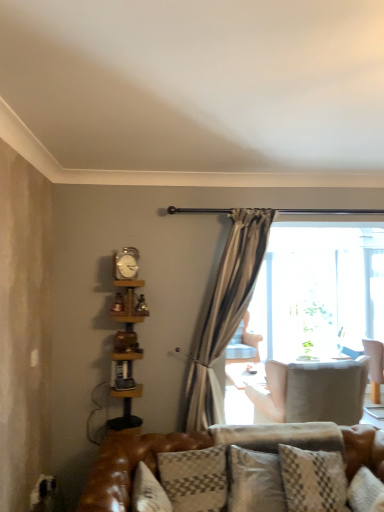
Image resolution: width=384 pixels, height=512 pixels. What are the coordinates of `wooden bookshelf at left` in the screenshot? It's located at (127, 336).

This screenshot has width=384, height=512. Identify the location of velvet beige chair at center, the 1th chair viewed from the back. (243, 344).

Measure the distance between point (314, 402) and camera.

The distance of point (314, 402) from camera is 3.33 meters.

What do you see at coordinates (126, 263) in the screenshot? This screenshot has height=512, width=384. I see `metallic silver clock at upper center` at bounding box center [126, 263].

In the scene shown: In order to face clear glass screen door at center, should I rotate leftwards or rightwards?

Rotate right and turn 10.289 degrees.

Locate an element on the screen. This screenshot has height=512, width=384. plush gray pillow at center, the first pillow when ordered from right to left is located at coordinates (280, 436).

Describe the element at coordinates (195, 479) in the screenshot. This screenshot has width=384, height=512. I see `plaid fabric pillow at center, the 2th pillow in the back-to-front sequence` at that location.

The width and height of the screenshot is (384, 512). I want to click on light beige fabric chair at right, the third chair positioned from the left, so click(375, 367).

From the image's perspective, which one is positioned lower, plaid fabric pillow at center, which is the 1th pillow in left-to-right order, or light beige fabric chair at right, positioned as the first chair in right-to-left order?

light beige fabric chair at right, positioned as the first chair in right-to-left order.

Considering the sizes of plaid fabric pillow at center, which is the 1th pillow in left-to-right order, and light beige fabric chair at right, the third chair positioned from the left, in the image, is plaid fabric pillow at center, which is the 1th pillow in left-to-right order, bigger or smaller than light beige fabric chair at right, the third chair positioned from the left,?

In the image, plaid fabric pillow at center, which is the 1th pillow in left-to-right order, appears to be smaller than light beige fabric chair at right, the third chair positioned from the left.

How many degrees apart are the facing directions of plaid fabric pillow at center, the 2th pillow in the back-to-front sequence, and light beige fabric chair at right, positioned as the first chair in right-to-left order?

93.4 degrees.

Is plaid fabric pillow at center, which is the 1th pillow in left-to-right order, not inside light beige fabric chair at right, arranged as the 2th chair when viewed from the back?

Yes, plaid fabric pillow at center, which is the 1th pillow in left-to-right order, is outside of light beige fabric chair at right, arranged as the 2th chair when viewed from the back.

Is plaid fabric pillow at center, which is the 1th pillow in left-to-right order, shorter than plush gray pillow at center, arranged as the second pillow when viewed from the front?

No.

Would you say plush gray pillow at center, arranged as the second pillow when viewed from the front, is part of plaid fabric pillow at center, the 2th pillow positioned from the right,'s contents?

No, plush gray pillow at center, arranged as the second pillow when viewed from the front, is not surrounded by plaid fabric pillow at center, the 2th pillow positioned from the right.

From the picture: Is plaid fabric pillow at center, the 2th pillow in the back-to-front sequence, placed right next to plush gray pillow at center, arranged as the second pillow when viewed from the front?

No, plaid fabric pillow at center, the 2th pillow in the back-to-front sequence, is not touching plush gray pillow at center, arranged as the second pillow when viewed from the front.

Does point (367, 348) come behind point (258, 297)?

Yes, point (367, 348) is behind point (258, 297).

Are light beige fabric chair at right, positioned as the first chair in right-to-left order, and clear glass screen door at center beside each other?

light beige fabric chair at right, positioned as the first chair in right-to-left order, is not next to clear glass screen door at center, and they're not touching.

This screenshot has height=512, width=384. Identify the location of the 3rd chair below when counting from the clear glass screen door at center (from the image's perspective). (375, 367).

Would you say light beige fabric chair at right, positioned as the first chair in right-to-left order, is inside or outside clear glass screen door at center?

light beige fabric chair at right, positioned as the first chair in right-to-left order, is not inside clear glass screen door at center, it's outside.

Does light beige fabric chair at center, the first chair in the front-to-back sequence, come behind velvet beige chair at center, the 1th chair viewed from the back?

No, it is in front of velvet beige chair at center, the 1th chair viewed from the back.

Can you confirm if light beige fabric chair at center, the 2th chair viewed from the right, is thinner than velvet beige chair at center, the 1th chair viewed from the back?

Yes.

From a real-world perspective, is light beige fabric chair at center, the first chair in the front-to-back sequence, located higher than velvet beige chair at center, the 3th chair when ordered from front to back?

Actually, light beige fabric chair at center, the first chair in the front-to-back sequence, is physically below velvet beige chair at center, the 3th chair when ordered from front to back, in the real world.

Based on their positions, is light beige fabric chair at center, the first chair in the front-to-back sequence, located to the left or right of velvet beige chair at center, positioned as the 3th chair in right-to-left order?

light beige fabric chair at center, the first chair in the front-to-back sequence, is positioned on velvet beige chair at center, positioned as the 3th chair in right-to-left order,'s right side.

Is light beige fabric chair at center, the 3th chair positioned from the back, oriented away from clear glass screen door at center?

No, light beige fabric chair at center, the 3th chair positioned from the back, is not facing away from clear glass screen door at center.

Considering the relative sizes of light beige fabric chair at center, the first chair in the front-to-back sequence, and clear glass screen door at center in the image provided, is light beige fabric chair at center, the first chair in the front-to-back sequence, wider than clear glass screen door at center?

Yes, light beige fabric chair at center, the first chair in the front-to-back sequence, is wider than clear glass screen door at center.

Where is `the 1st chair counting from the left side of the clear glass screen door at center`? This screenshot has height=512, width=384. the 1st chair counting from the left side of the clear glass screen door at center is located at coordinates (313, 391).

Is light beige fabric chair at center, the 3th chair positioned from the back, positioned before clear glass screen door at center?

Yes, it is.

Which is more to the left, light beige fabric chair at right, marked as the 2th chair in a front-to-back arrangement, or metallic silver clock at upper center?

From the viewer's perspective, metallic silver clock at upper center appears more on the left side.

Considering the relative sizes of light beige fabric chair at right, marked as the 2th chair in a front-to-back arrangement, and metallic silver clock at upper center in the image provided, is light beige fabric chair at right, marked as the 2th chair in a front-to-back arrangement, thinner than metallic silver clock at upper center?

In fact, light beige fabric chair at right, marked as the 2th chair in a front-to-back arrangement, might be wider than metallic silver clock at upper center.

Relative to metallic silver clock at upper center, is light beige fabric chair at right, the third chair positioned from the left, in front or behind?

In the image, light beige fabric chair at right, the third chair positioned from the left, appears behind metallic silver clock at upper center.

From a real-world perspective, is light beige fabric chair at right, positioned as the first chair in right-to-left order, below metallic silver clock at upper center?

Yes.

Is velvet beige chair at center, positioned as the 3th chair in right-to-left order, beside wooden bookshelf at left?

No, velvet beige chair at center, positioned as the 3th chair in right-to-left order, is not beside wooden bookshelf at left.

Considering the sizes of objects velvet beige chair at center, the 3th chair when ordered from front to back, and wooden bookshelf at left in the image provided, who is thinner, velvet beige chair at center, the 3th chair when ordered from front to back, or wooden bookshelf at left?

With smaller width is wooden bookshelf at left.

From a real-world perspective, which chair is the 1st one underneath the wooden bookshelf at left? Please provide its 2D coordinates.

[(243, 344)]

You are a GUI agent. You are given a task and a screenshot of the screen. Output one action in this format:
    pyautogui.click(x=<x>, y=<y>)
    Task: Click on the 2nd pillow in front of the light beige fabric chair at right, the third chair positioned from the left, counting from the anchor's position
    
    Given the screenshot: What is the action you would take?
    pyautogui.click(x=195, y=479)

Identify the location of pillow located on the right of plaid fabric pillow at center, the 2th pillow in the back-to-front sequence. Image resolution: width=384 pixels, height=512 pixels. (280, 436).

Estimate the real-world distances between objects in this image. Which object is further from wooden bookshelf at left, metallic silver clock at upper center or light beige fabric chair at right, the third chair positioned from the left?

light beige fabric chair at right, the third chair positioned from the left, is further to wooden bookshelf at left.

Based on their spatial positions, is metallic silver clock at upper center or plaid fabric pillow at center, the 2th pillow in the back-to-front sequence, closer to velvet beige chair at center, the 3th chair when ordered from front to back?

plaid fabric pillow at center, the 2th pillow in the back-to-front sequence.

In the scene shown: Estimate the real-world distances between objects in this image. Which object is closer to wooden bookshelf at left, light beige fabric chair at right, positioned as the first chair in right-to-left order, or metallic silver clock at upper center?

metallic silver clock at upper center is closer to wooden bookshelf at left.

Based on their spatial positions, is metallic silver clock at upper center or light beige fabric chair at right, positioned as the first chair in right-to-left order, further from plaid fabric pillow at center, which is the 1th pillow in left-to-right order?

light beige fabric chair at right, positioned as the first chair in right-to-left order, is further to plaid fabric pillow at center, which is the 1th pillow in left-to-right order.

From the picture: From the image, which object appears to be nearer to light beige fabric chair at center, which is the 2th chair from left to right, wooden bookshelf at left or plaid fabric pillow at center, the 1th pillow from the front?

plaid fabric pillow at center, the 1th pillow from the front, is positioned closer to the anchor light beige fabric chair at center, which is the 2th chair from left to right.

From the picture: Estimate the real-world distances between objects in this image. Which object is further from clear glass screen door at center, velvet beige chair at center, the 1th chair viewed from the back, or light beige fabric chair at right, marked as the 2th chair in a front-to-back arrangement?

light beige fabric chair at right, marked as the 2th chair in a front-to-back arrangement, is positioned further to the anchor clear glass screen door at center.

When comparing their distances from metallic silver clock at upper center, does plush gray pillow at center, the first pillow when ordered from right to left, or velvet beige chair at center, the 1th chair viewed from the back, seem closer?

velvet beige chair at center, the 1th chair viewed from the back, is positioned closer to the anchor metallic silver clock at upper center.

Based on the photo, considering their positions, is metallic silver clock at upper center positioned closer to plush gray pillow at center, arranged as the second pillow when viewed from the front, than light beige fabric chair at right, the third chair positioned from the left?

Among the two, metallic silver clock at upper center is located nearer to plush gray pillow at center, arranged as the second pillow when viewed from the front.

Locate an element on the screen. The height and width of the screenshot is (512, 384). bookshelf between plaid fabric pillow at center, the 2th pillow positioned from the right, and velvet beige chair at center, positioned as the 3th chair in right-to-left order, in the front-back direction is located at coordinates (127, 336).

Find the location of `pillow between metallic silver clock at upper center and plaid fabric pillow at center, the 1th pillow from the front, in the vertical direction`. pillow between metallic silver clock at upper center and plaid fabric pillow at center, the 1th pillow from the front, in the vertical direction is located at coordinates (280, 436).

Locate an element on the screen. pillow between plaid fabric pillow at center, which is the 1th pillow in left-to-right order, and light beige fabric chair at right, marked as the 2th chair in a front-to-back arrangement, along the z-axis is located at coordinates (280, 436).

At what (x,y) coordinates should I click in order to perform the action: click on clock between wooden bookshelf at left and clear glass screen door at center along the z-axis. Please return your answer as a coordinate pair (x, y). Looking at the image, I should click on (126, 263).